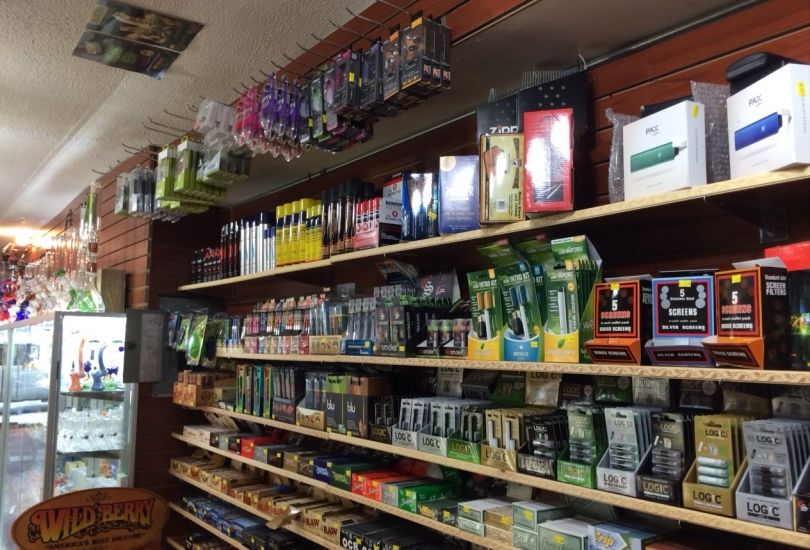
Locate an element on the screen. The width and height of the screenshot is (810, 550). shelfs is located at coordinates (488, 232).